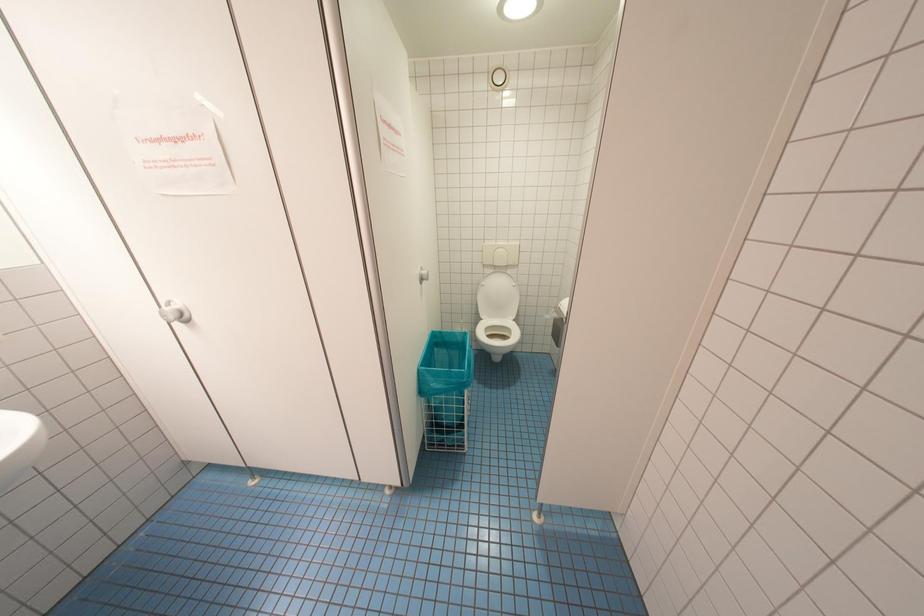
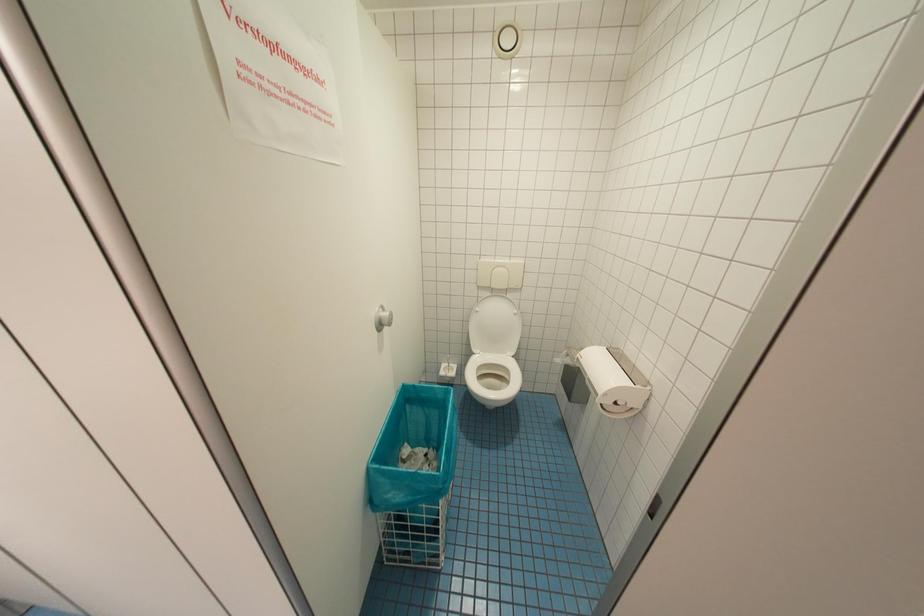
Question: The images are taken continuously from a first-person perspective. In which direction are you moving?

Choices:
 (A) Left
 (B) Right
 (C) Forward
 (D) Backward

Answer: (C)